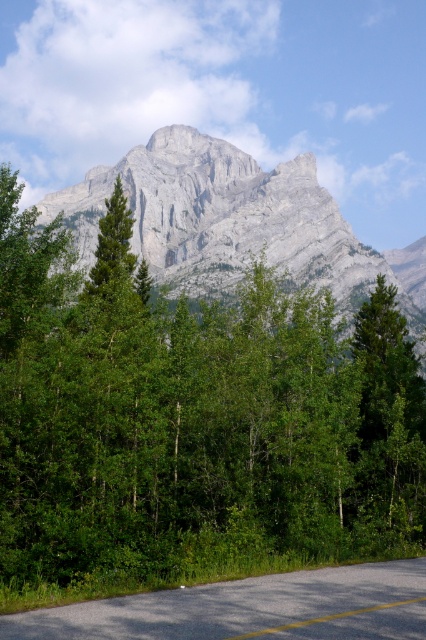
You are a hiker standing on the road and want to take a photo of both the green leafy tree at center and the gray rock mountain at upper center. Which object should you position closer to the left side of your camera frame to include both in the photo?

To include both the green leafy tree at center and the gray rock mountain at upper center in your photo, position the gray rock mountain at upper center closer to the left side of your camera frame since the green leafy tree at center is located to the right of it.

You are a hiker who wants to take a photo of the gray rock mountain at upper center while standing on the gray asphalt road at center. Can you see the entire mountain from your position on the road?

The gray rock mountain at upper center is located above the gray asphalt road at center, so yes, you can see the entire mountain from your position on the road since it is positioned above you.